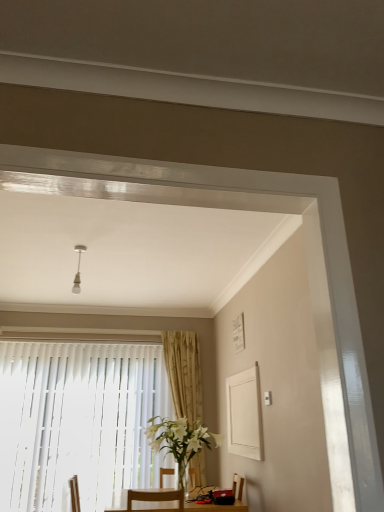
Locate an element on the screen. The image size is (384, 512). free spot above white vertical blinds at lower left (from a real-world perspective) is located at coordinates (97, 336).